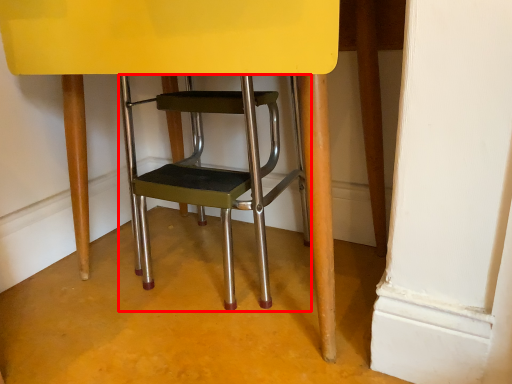
Question: From the image's perspective, where is stool (annotated by the red box) located in relation to chair in the image?

Choices:
 (A) below
 (B) above

Answer: (A)